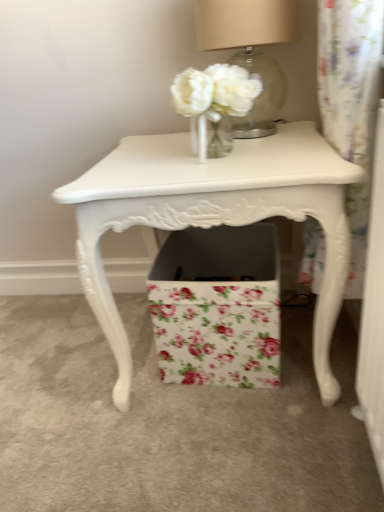
You are a GUI agent. You are given a task and a screenshot of the screen. Output one action in this format:
    pyautogui.click(x=<x>, y=<y>)
    Task: Click on the vacant area that lies in front of floral paper box at center
    This screenshot has height=512, width=384.
    Given the screenshot: What is the action you would take?
    pyautogui.click(x=237, y=432)